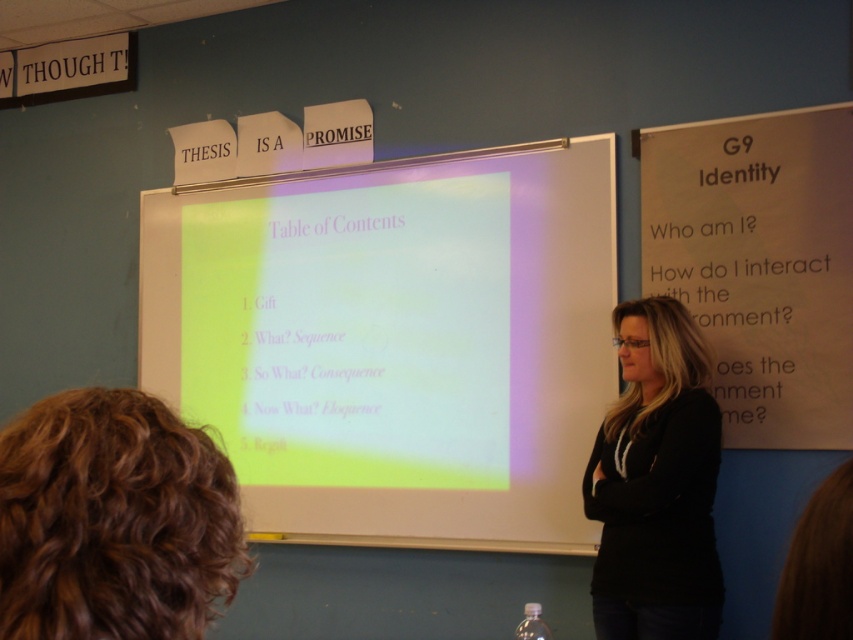
You are a student in the classroom and need to place both the white paper at right and the black cotton shirt at center on a shelf. The shelf has limited space. Which object should you place first to ensure both fit?

The white paper at right is wider than the black cotton shirt at center. To ensure both fit on the shelf, place the wider white paper at right first, then the narrower black cotton shirt at center.

You are a student sitting in the classroom and want to look at the matte white projector screen at center. Where should you look?

The matte white projector screen at center is located at point coordinates of (393, 340), so you should look towards that position to see it clearly.

You are a student trying to present a slide that requires a wider canvas. You have a matte white projector screen at center and a white paper at right. Which object can you use to display your content if you need more width?

The matte white projector screen at center might be wider than white paper at right, so it is better to use the matte white projector screen at center for displaying content that requires more width.